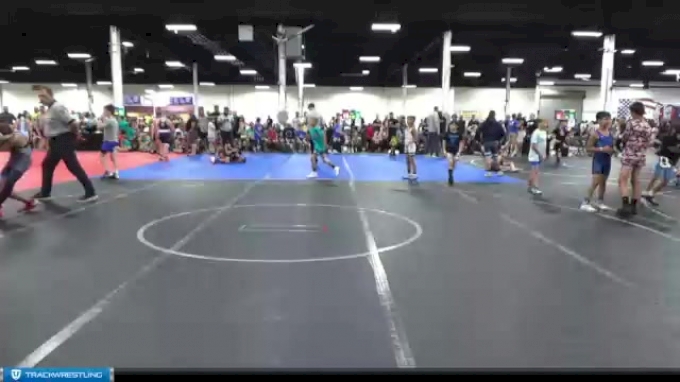
Identify the location of floor. (256, 306), (544, 293).